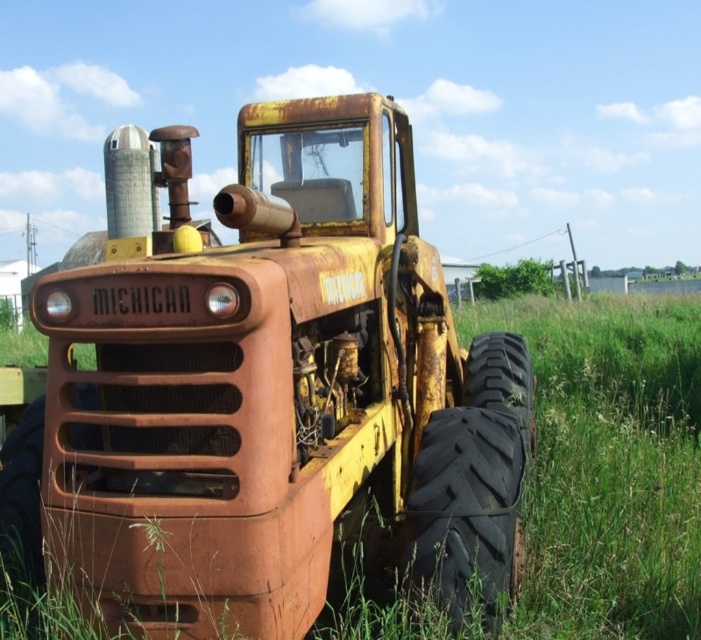
Question: Is black rubber tire at lower right smaller than rusty rubber tire at lower right?

Choices:
 (A) yes
 (B) no

Answer: (A)

Question: Is rusty metal tractor at center wider than rusty rubber tire at lower right?

Choices:
 (A) no
 (B) yes

Answer: (B)

Question: Which of these objects is positioned closest to the black rubber tire at lower right?

Choices:
 (A) rusty rubber tire at lower right
 (B) rusty metal tractor at center

Answer: (B)

Question: Which point is farther to the camera?

Choices:
 (A) (491, 332)
 (B) (57, 413)
 (C) (449, 540)

Answer: (A)

Question: Which point appears closest to the camera in this image?

Choices:
 (A) (191, 564)
 (B) (423, 477)
 (C) (484, 360)

Answer: (A)

Question: From the image, what is the correct spatial relationship of black rubber tire at lower right in relation to rusty rubber tire at lower right?

Choices:
 (A) right
 (B) left

Answer: (B)